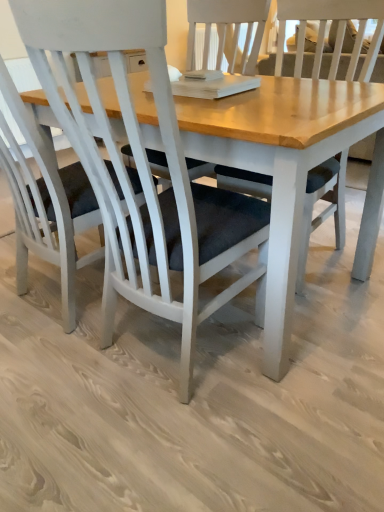
Question: Could you tell me if white matte chair at center, marked as the 2th chair in a right-to-left arrangement, is turned towards white matte chair at center, the 2th chair from the left?

Choices:
 (A) no
 (B) yes

Answer: (A)

Question: Considering the relative positions of white matte chair at center, marked as the 1th chair in a left-to-right arrangement, and white matte chair at center, which is counted as the 1th chair, starting from the right, in the image provided, is white matte chair at center, marked as the 1th chair in a left-to-right arrangement, to the left of white matte chair at center, which is counted as the 1th chair, starting from the right, from the viewer's perspective?

Choices:
 (A) no
 (B) yes

Answer: (B)

Question: Is white matte chair at center, which is counted as the 1th chair, starting from the right, a part of white matte chair at center, marked as the 2th chair in a right-to-left arrangement?

Choices:
 (A) yes
 (B) no

Answer: (B)

Question: Does white matte chair at center, marked as the 2th chair in a right-to-left arrangement, come behind white matte chair at center, the 2th chair from the left?

Choices:
 (A) no
 (B) yes

Answer: (B)

Question: Is white matte chair at center, marked as the 1th chair in a left-to-right arrangement, outside white matte chair at center, which is counted as the 1th chair, starting from the right?

Choices:
 (A) no
 (B) yes

Answer: (B)

Question: Considering the relative sizes of white matte chair at center, marked as the 1th chair in a left-to-right arrangement, and white matte chair at center, the 2th chair from the left, in the image provided, is white matte chair at center, marked as the 1th chair in a left-to-right arrangement, taller than white matte chair at center, the 2th chair from the left,?

Choices:
 (A) no
 (B) yes

Answer: (B)

Question: Is white matte chair at center, which is counted as the 1th chair, starting from the right, turned away from white matte chair at center, marked as the 2th chair in a right-to-left arrangement?

Choices:
 (A) no
 (B) yes

Answer: (A)

Question: Is white matte chair at center, which is counted as the 1th chair, starting from the right, outside of white matte chair at center, marked as the 2th chair in a right-to-left arrangement?

Choices:
 (A) yes
 (B) no

Answer: (A)

Question: Is white matte chair at center, the 2th chair from the left, smaller than white matte chair at center, marked as the 1th chair in a left-to-right arrangement?

Choices:
 (A) no
 (B) yes

Answer: (B)

Question: Can you confirm if white matte chair at center, which is counted as the 1th chair, starting from the right, is taller than white matte chair at center, marked as the 2th chair in a right-to-left arrangement?

Choices:
 (A) no
 (B) yes

Answer: (A)

Question: Is white matte chair at center, the 2th chair from the left, closer to camera compared to white matte chair at center, marked as the 1th chair in a left-to-right arrangement?

Choices:
 (A) yes
 (B) no

Answer: (A)

Question: Considering the relative sizes of white matte chair at center, the 2th chair from the left, and white matte chair at center, marked as the 2th chair in a right-to-left arrangement, in the image provided, is white matte chair at center, the 2th chair from the left, shorter than white matte chair at center, marked as the 2th chair in a right-to-left arrangement,?

Choices:
 (A) no
 (B) yes

Answer: (B)

Question: In the image, is white matte chair at center, marked as the 1th chair in a left-to-right arrangement, positioned in front of or behind white matte chair at center, which is counted as the 1th chair, starting from the right?

Choices:
 (A) front
 (B) behind

Answer: (B)